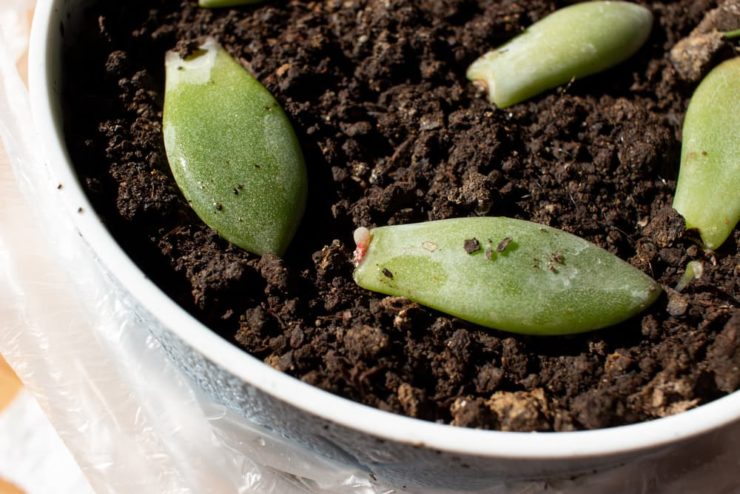
You are a GUI agent. You are given a task and a screenshot of the screen. Output one action in this format:
    pyautogui.click(x=<x>, y=<y>)
    Task: Click on the ceramic planter rim
    
    Given the screenshot: What is the action you would take?
    (x=345, y=414)